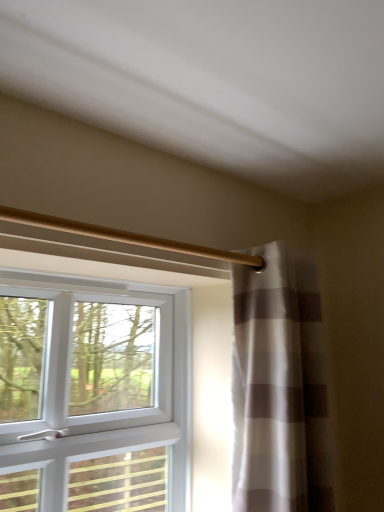
Question: From the image's perspective, is white striped curtain at right located above white plastic window at left?

Choices:
 (A) yes
 (B) no

Answer: (A)

Question: Considering the relative sizes of white striped curtain at right and white plastic window at left in the image provided, is white striped curtain at right smaller than white plastic window at left?

Choices:
 (A) yes
 (B) no

Answer: (A)

Question: Can you confirm if white striped curtain at right is shorter than white plastic window at left?

Choices:
 (A) yes
 (B) no

Answer: (B)

Question: Is white striped curtain at right thinner than white plastic window at left?

Choices:
 (A) no
 (B) yes

Answer: (A)

Question: Would you consider white striped curtain at right to be distant from white plastic window at left?

Choices:
 (A) no
 (B) yes

Answer: (A)

Question: From a real-world perspective, is white plastic window at left above or below gold metallic curtain rod at upper center?

Choices:
 (A) above
 (B) below

Answer: (B)

Question: Is white plastic window at left taller or shorter than gold metallic curtain rod at upper center?

Choices:
 (A) short
 (B) tall

Answer: (B)

Question: Is white plastic window at left situated inside gold metallic curtain rod at upper center or outside?

Choices:
 (A) inside
 (B) outside

Answer: (B)

Question: From the image's perspective, is white plastic window at left positioned above or below gold metallic curtain rod at upper center?

Choices:
 (A) above
 (B) below

Answer: (B)

Question: Is point (153, 314) closer or farther from the camera than point (233, 380)?

Choices:
 (A) farther
 (B) closer

Answer: (A)

Question: In the image, is white plastic window at left positioned in front of or behind white striped curtain at right?

Choices:
 (A) front
 (B) behind

Answer: (A)

Question: From a real-world perspective, is white plastic window at left physically located above or below white striped curtain at right?

Choices:
 (A) above
 (B) below

Answer: (B)

Question: In terms of size, does white plastic window at left appear bigger or smaller than white striped curtain at right?

Choices:
 (A) small
 (B) big

Answer: (B)

Question: Considering the positions of white striped curtain at right and gold metallic curtain rod at upper center in the image, is white striped curtain at right taller or shorter than gold metallic curtain rod at upper center?

Choices:
 (A) short
 (B) tall

Answer: (B)

Question: Relative to gold metallic curtain rod at upper center, is white striped curtain at right in front or behind?

Choices:
 (A) behind
 (B) front

Answer: (A)